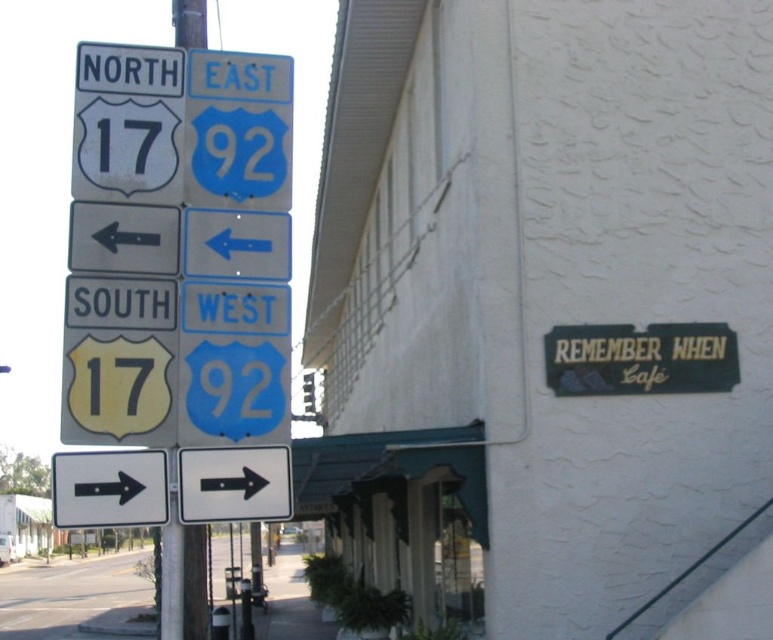
Can you confirm if metallic pole at left is bigger than yellow matte sign at left?

Correct, metallic pole at left is larger in size than yellow matte sign at left.

Where is `metallic pole at left`? The width and height of the screenshot is (773, 640). metallic pole at left is located at coordinates pos(182,582).

Where is `metallic pole at left`? metallic pole at left is located at coordinates (182, 582).